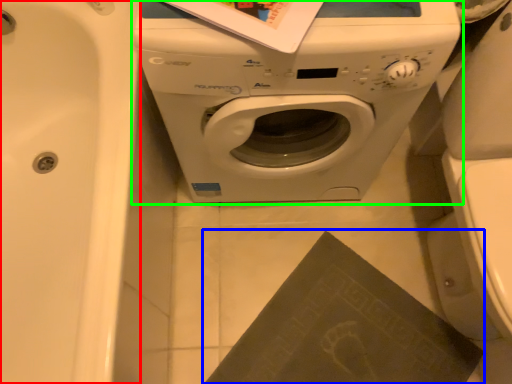
Question: Which object is the farthest from bath (highlighted by a red box)? Choose among these: paperback book (highlighted by a blue box) or washing machine (highlighted by a green box).

Choices:
 (A) paperback book
 (B) washing machine

Answer: (A)